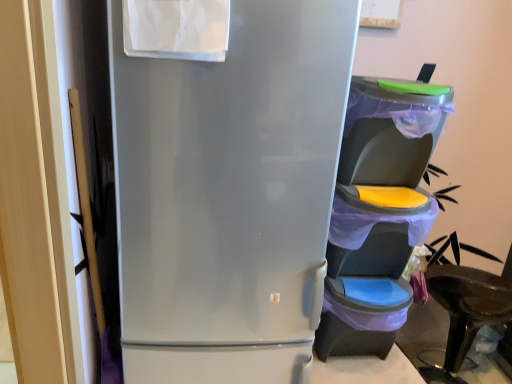
Locate an element on the screen. wooden folding chair at lower right is located at coordinates (469, 312).

This screenshot has width=512, height=384. What do you see at coordinates (469, 312) in the screenshot?
I see `wooden folding chair at lower right` at bounding box center [469, 312].

Locate an element on the screen. The image size is (512, 384). wooden folding chair at lower right is located at coordinates (469, 312).